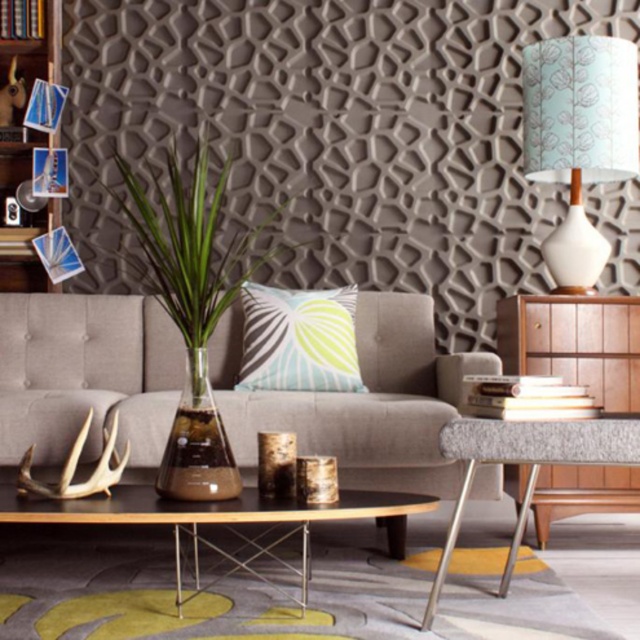
The width and height of the screenshot is (640, 640). I want to click on metallic silver table at lower right, so click(x=529, y=465).

Which is in front, point (609, 460) or point (264, 324)?

Point (609, 460) is more forward.

Where is `metallic silver table at lower right`? This screenshot has height=640, width=640. metallic silver table at lower right is located at coordinates (529, 465).

You are a GUI agent. You are given a task and a screenshot of the screen. Output one action in this format:
    pyautogui.click(x=<x>, y=<y>)
    Task: Click on the metallic silver table at lower right
    This screenshot has height=640, width=640.
    Given the screenshot: What is the action you would take?
    pyautogui.click(x=529, y=465)

Is textured blue-green pillow at center shorter than wooden bookshelf at left?

Yes.

Who is lower down, textured blue-green pillow at center or wooden bookshelf at left?

textured blue-green pillow at center

Where is `textured blue-green pillow at center`? The height and width of the screenshot is (640, 640). textured blue-green pillow at center is located at coordinates (298, 339).

Who is more distant from viewer, (125,189) or (132,513)?

Point (125,189)

Does clear glass vase at center appear on the left side of wooden table at center?

Yes, clear glass vase at center is to the left of wooden table at center.

Between point (186, 336) and point (16, 509), which one is positioned behind?

The point (186, 336) is behind.

The image size is (640, 640). What are the coordinates of `clear glass vase at center` in the screenshot? It's located at (188, 248).